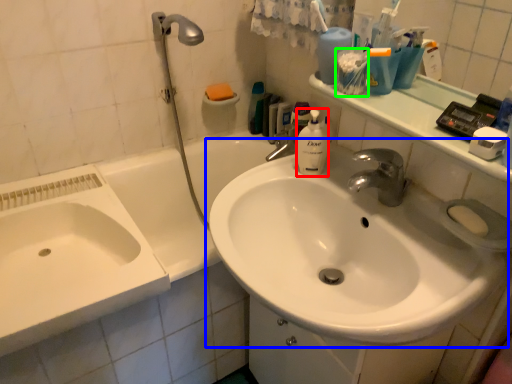
Question: Considering the real-world distances, which object is closest to cleaning product (highlighted by a red box)? sink (highlighted by a blue box) or mouthwash (highlighted by a green box).

Choices:
 (A) sink
 (B) mouthwash

Answer: (B)